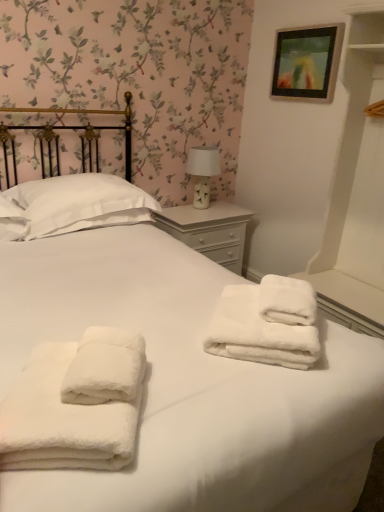
Question: Is the position of white soft pillow at upper left more distant than that of white painted wood nightstand at center?

Choices:
 (A) yes
 (B) no

Answer: (B)

Question: Are white soft pillow at upper left and white painted wood nightstand at center beside each other?

Choices:
 (A) yes
 (B) no

Answer: (B)

Question: Does white soft pillow at upper left appear on the left side of white painted wood nightstand at center?

Choices:
 (A) no
 (B) yes

Answer: (B)

Question: From a real-world perspective, does white soft pillow at upper left stand above white painted wood nightstand at center?

Choices:
 (A) no
 (B) yes

Answer: (B)

Question: Is white soft pillow at upper left facing away from white painted wood nightstand at center?

Choices:
 (A) yes
 (B) no

Answer: (B)

Question: From a real-world perspective, is wooden picture frame at upper right physically located above or below white ceramic table lamp at upper right?

Choices:
 (A) above
 (B) below

Answer: (A)

Question: Visually, is wooden picture frame at upper right positioned to the left or to the right of white ceramic table lamp at upper right?

Choices:
 (A) left
 (B) right

Answer: (B)

Question: From the image's perspective, is wooden picture frame at upper right located above or below white ceramic table lamp at upper right?

Choices:
 (A) below
 (B) above

Answer: (B)

Question: In terms of width, does wooden picture frame at upper right look wider or thinner when compared to white ceramic table lamp at upper right?

Choices:
 (A) thin
 (B) wide

Answer: (A)

Question: Does point (21, 415) appear closer or farther from the camera than point (18, 205)?

Choices:
 (A) farther
 (B) closer

Answer: (B)

Question: Relative to white soft pillow at upper left, is white fluffy towels at center, acting as the 2th towel starting from the right, in front or behind?

Choices:
 (A) behind
 (B) front

Answer: (B)

Question: From the image's perspective, is white fluffy towels at center, acting as the 2th towel starting from the back, located above or below white soft pillow at upper left?

Choices:
 (A) below
 (B) above

Answer: (A)

Question: From their relative heights in the image, would you say white fluffy towels at center, acting as the 2th towel starting from the back, is taller or shorter than white soft pillow at upper left?

Choices:
 (A) short
 (B) tall

Answer: (A)

Question: In terms of height, does white soft pillow at upper left look taller or shorter compared to wooden picture frame at upper right?

Choices:
 (A) tall
 (B) short

Answer: (B)

Question: Would you say white soft pillow at upper left is to the left or to the right of wooden picture frame at upper right in the picture?

Choices:
 (A) left
 (B) right

Answer: (A)